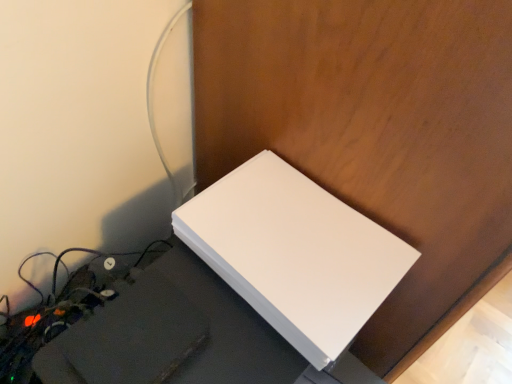
Question: Should I look upward or downward to see white matte computer desk at lower left?

Choices:
 (A) up
 (B) down

Answer: (B)

Question: Is white matte computer desk at lower left shorter than white matte wii at center?

Choices:
 (A) yes
 (B) no

Answer: (B)

Question: Can you confirm if white matte computer desk at lower left is thinner than white matte wii at center?

Choices:
 (A) no
 (B) yes

Answer: (A)

Question: From the image's perspective, would you say white matte computer desk at lower left is positioned over white matte wii at center?

Choices:
 (A) yes
 (B) no

Answer: (B)

Question: Could white matte wii at center be considered to be inside white matte computer desk at lower left?

Choices:
 (A) yes
 (B) no

Answer: (B)

Question: Considering the relative positions of white matte computer desk at lower left and white matte wii at center in the image provided, is white matte computer desk at lower left to the left of white matte wii at center from the viewer's perspective?

Choices:
 (A) no
 (B) yes

Answer: (B)

Question: Is white matte computer desk at lower left smaller than white matte wii at center?

Choices:
 (A) yes
 (B) no

Answer: (B)

Question: Is white matte wii at center looking in the opposite direction of white matte computer desk at lower left?

Choices:
 (A) no
 (B) yes

Answer: (A)

Question: From a real-world perspective, does white matte wii at center stand above white matte computer desk at lower left?

Choices:
 (A) no
 (B) yes

Answer: (B)

Question: Is white matte wii at center with white matte computer desk at lower left?

Choices:
 (A) yes
 (B) no

Answer: (B)

Question: Is white matte wii at center facing towards white matte computer desk at lower left?

Choices:
 (A) yes
 (B) no

Answer: (B)

Question: Would you consider white matte wii at center to be distant from white matte computer desk at lower left?

Choices:
 (A) no
 (B) yes

Answer: (A)

Question: Does white matte wii at center have a lesser height compared to white matte computer desk at lower left?

Choices:
 (A) no
 (B) yes

Answer: (B)

Question: From the image's perspective, is white matte computer desk at lower left positioned above or below white matte wii at center?

Choices:
 (A) below
 (B) above

Answer: (A)